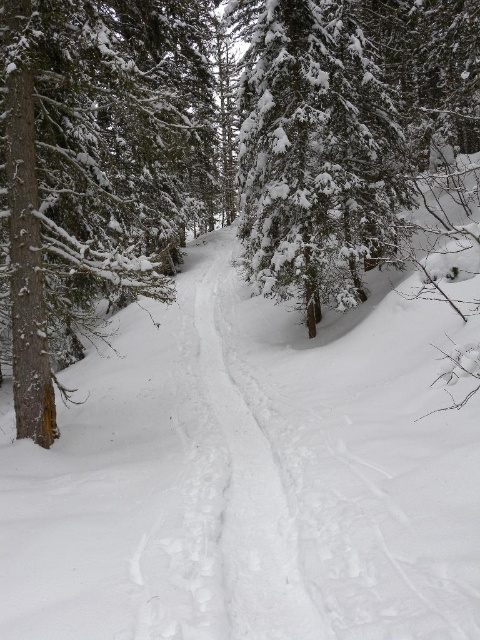
Question: Which point is farther to the camera?

Choices:
 (A) [x=218, y=364]
 (B) [x=404, y=134]
 (C) [x=60, y=221]

Answer: (B)

Question: Does brown wood tree at left have a larger size compared to white snow trail at center?

Choices:
 (A) no
 (B) yes

Answer: (B)

Question: Which object appears farthest from the camera in this image?

Choices:
 (A) white snow trail at center
 (B) brown wood tree at left
 (C) green textured pine tree at left

Answer: (B)

Question: Is green textured pine tree at left above white snow trail at center?

Choices:
 (A) yes
 (B) no

Answer: (A)

Question: Can you confirm if green textured pine tree at left is bigger than brown wood tree at left?

Choices:
 (A) no
 (B) yes

Answer: (B)

Question: Based on their relative distances, which object is farther from the brown wood tree at left?

Choices:
 (A) white snow trail at center
 (B) green textured pine tree at left

Answer: (A)